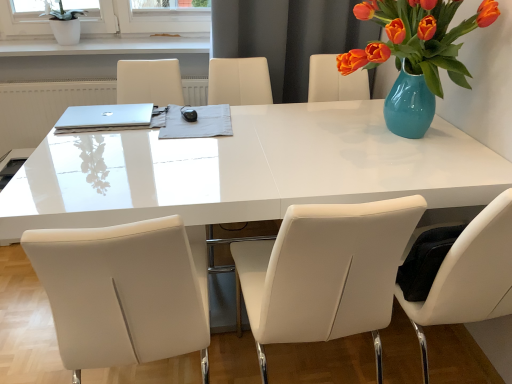
Question: Is white leather chair at center, the second chair from the left, shorter than white leather chair at center, the second chair positioned from the right?

Choices:
 (A) yes
 (B) no

Answer: (B)

Question: Is white leather chair at center, the second chair from the left, to the left of white leather chair at center, arranged as the first chair when viewed from the left, from the viewer's perspective?

Choices:
 (A) yes
 (B) no

Answer: (B)

Question: Does white leather chair at center, placed as the first chair when sorted from right to left, have a lesser width compared to white leather chair at center, the second chair positioned from the right?

Choices:
 (A) yes
 (B) no

Answer: (A)

Question: Can you confirm if white leather chair at center, the second chair from the left, is positioned to the right of white leather chair at center, arranged as the first chair when viewed from the left?

Choices:
 (A) yes
 (B) no

Answer: (A)

Question: Does white leather chair at center, placed as the first chair when sorted from right to left, have a larger size compared to white leather chair at center, the second chair positioned from the right?

Choices:
 (A) yes
 (B) no

Answer: (B)

Question: Is white leather chair at center, the second chair positioned from the right, inside or outside of gray fabric at center?

Choices:
 (A) outside
 (B) inside

Answer: (A)

Question: From a real-world perspective, relative to gray fabric at center, is white leather chair at center, arranged as the first chair when viewed from the left, vertically above or below?

Choices:
 (A) below
 (B) above

Answer: (A)

Question: From the image's perspective, is white leather chair at center, arranged as the first chair when viewed from the left, located above or below gray fabric at center?

Choices:
 (A) above
 (B) below

Answer: (B)

Question: Looking at their shapes, would you say white leather chair at center, the second chair positioned from the right, is wider or thinner than gray fabric at center?

Choices:
 (A) thin
 (B) wide

Answer: (B)

Question: In the image, is white leather chair at center, the second chair from the left, positioned in front of or behind gray fabric at center?

Choices:
 (A) front
 (B) behind

Answer: (A)

Question: Does point (356, 299) appear closer or farther from the camera than point (181, 127)?

Choices:
 (A) farther
 (B) closer

Answer: (B)

Question: Would you say white leather chair at center, the second chair from the left, is to the left or to the right of gray fabric at center in the picture?

Choices:
 (A) left
 (B) right

Answer: (B)

Question: Would you say white leather chair at center, the second chair from the left, is inside or outside gray fabric at center?

Choices:
 (A) outside
 (B) inside

Answer: (A)

Question: Is white glossy table at center taller or shorter than silver metallic laptop at upper left?

Choices:
 (A) short
 (B) tall

Answer: (B)

Question: Choose the correct answer: Is white glossy table at center inside silver metallic laptop at upper left or outside it?

Choices:
 (A) outside
 (B) inside

Answer: (A)